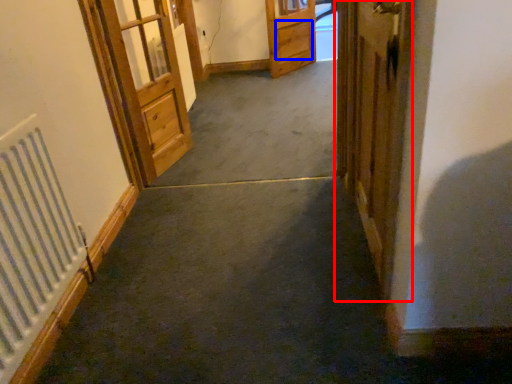
Question: Which point is closer to the camera, door (highlighted by a red box) or drawer (highlighted by a blue box)?

Choices:
 (A) door
 (B) drawer

Answer: (A)